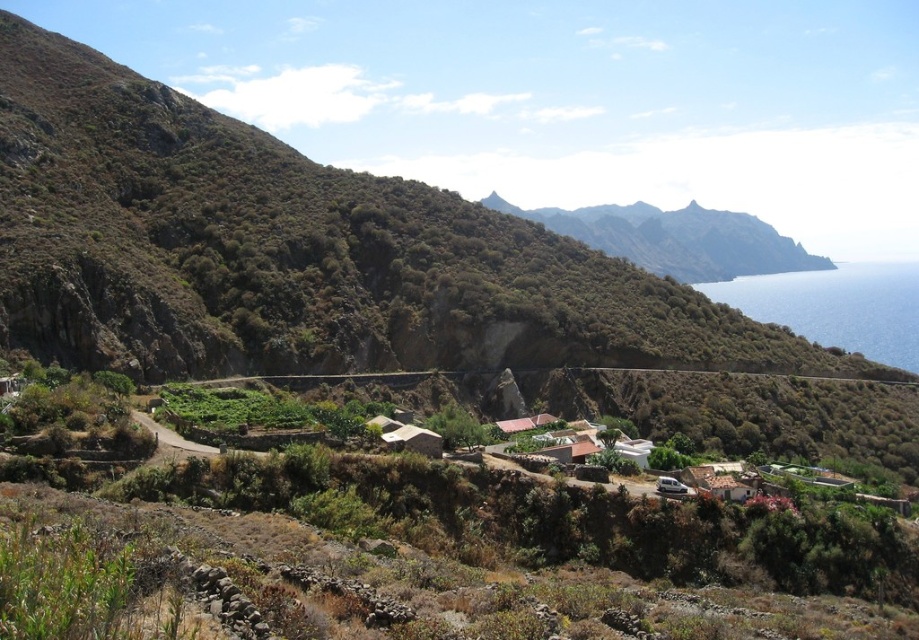
You are a hiker planning to take a photo of the green textured mountain at upper center and the blue water at right. Which of these two elements will appear smaller in your photo?

The green textured mountain at upper center will appear smaller in the photo because it occupies less space than the blue water at right.

Looking at this image, you are a hiker planning to take a photo of the green textured mountain at upper center and the blue water at right from a spot along the winding dirt path. Which object will appear narrower in your photo?

The green textured mountain at upper center will appear narrower in the photo because it is thinner than the blue water at right.